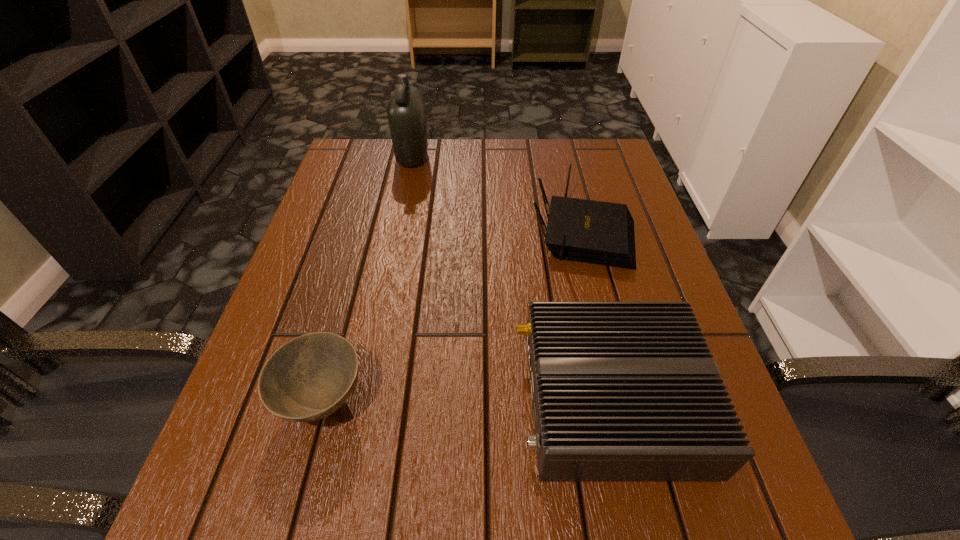
Image resolution: width=960 pixels, height=540 pixels. I want to click on the farthest object, so click(406, 113).

Locate an element on the screen. This screenshot has height=540, width=960. the tallest object is located at coordinates (406, 113).

The height and width of the screenshot is (540, 960). Identify the location of the third nearest object. (588, 231).

At what (x,y) coordinates should I click in order to perform the action: click on the nearer router. Please return your answer as a coordinate pair (x, y). Image resolution: width=960 pixels, height=540 pixels. Looking at the image, I should click on (621, 391).

This screenshot has width=960, height=540. I want to click on bowl, so click(x=308, y=378).

You are a GUI agent. You are given a task and a screenshot of the screen. Output one action in this format:
    pyautogui.click(x=<x>, y=<y>)
    Task: Click on the vacant space located on the front of the farthest object
    
    Given the screenshot: What is the action you would take?
    pyautogui.click(x=405, y=193)

At what (x,y) coordinates should I click in order to perform the action: click on free location located on the front of the second farthest object. Please return your answer as a coordinate pair (x, y). Looking at the image, I should click on (608, 331).

Locate an element on the screen. Image resolution: width=960 pixels, height=540 pixels. vacant space located 0.130m on the back panel of the nearer router is located at coordinates (437, 400).

Find the location of a particular element. The height and width of the screenshot is (540, 960). free space located on the back panel of the nearer router is located at coordinates tap(399, 400).

At what (x,y) coordinates should I click in order to perform the action: click on vacant position located on the back panel of the nearer router. Please return your answer as a coordinate pair (x, y). This screenshot has width=960, height=540. Looking at the image, I should click on (268, 400).